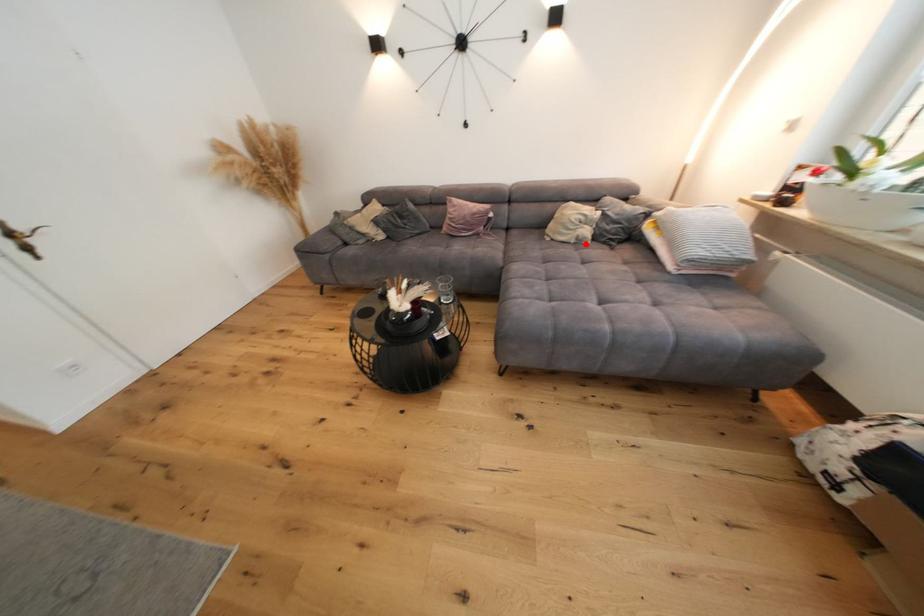
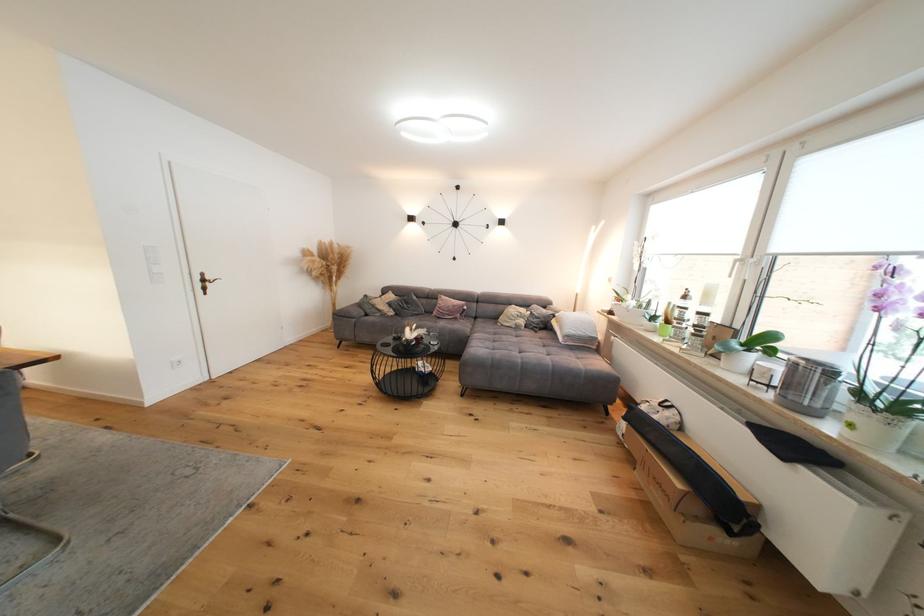
Question: I am providing you with two images of the same scene from different viewpoints. Given a red point in image1, look at the same physical point in image2. Is it:

Choices:
 (A) Closer to the viewpoint
 (B) Farther from the viewpoint

Answer: (B)